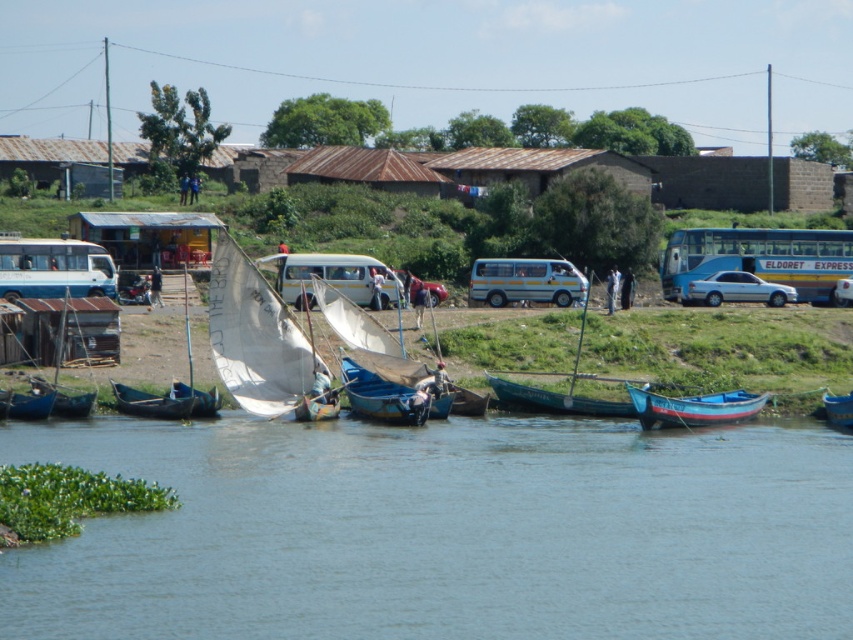
Question: Among these objects, which one is nearest to the camera?

Choices:
 (A) white sailboat at center
 (B) blue painted wooden boat at lower right

Answer: (B)

Question: Based on their relative distances, which object is farther from the blue painted wooden boat at lower right?

Choices:
 (A) teal wooden boat at center
 (B) white canvas sail at center

Answer: (B)

Question: Does blue wooden boat at center have a lesser width compared to teal wooden boat at center?

Choices:
 (A) no
 (B) yes

Answer: (B)

Question: Considering the real-world distances, which object is farthest from the yellow matte van at center?

Choices:
 (A) blue wooden boats at lower center
 (B) white canvas sail at center
 (C) white matte van at center
 (D) metallic silver car at center

Answer: (A)

Question: Does blue metallic bus at right appear on the left side of wooden sailboat at lower left?

Choices:
 (A) no
 (B) yes

Answer: (A)

Question: Is white canvas sail at center positioned in front of silver metallic sedan at center?

Choices:
 (A) no
 (B) yes

Answer: (B)